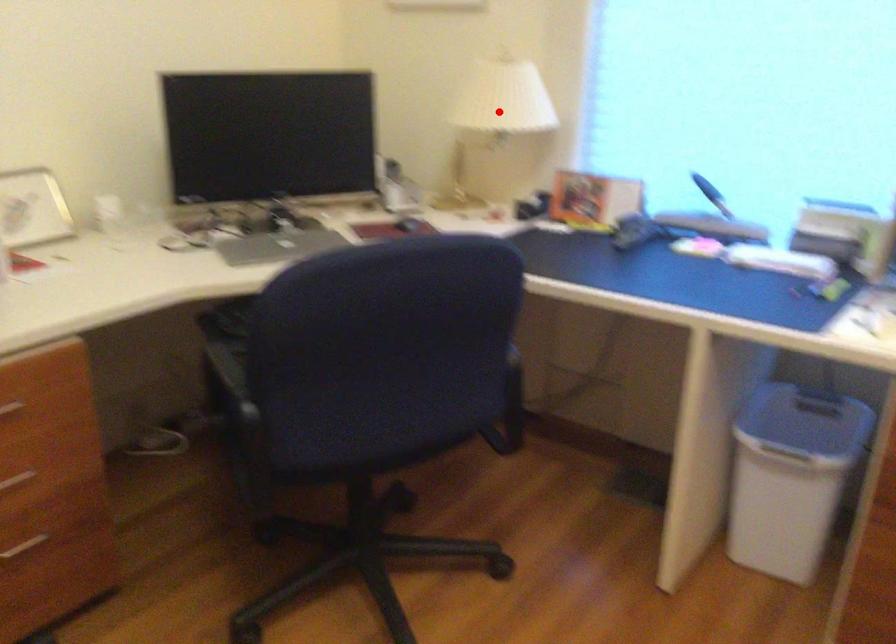
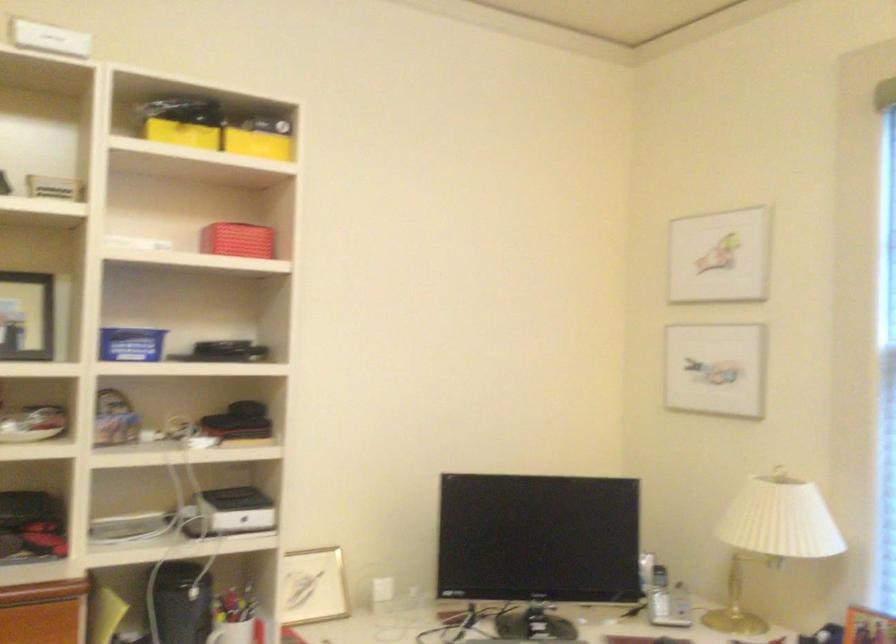
Find the pixel in the second image that matches the highlighted location in the first image.

(771, 538)